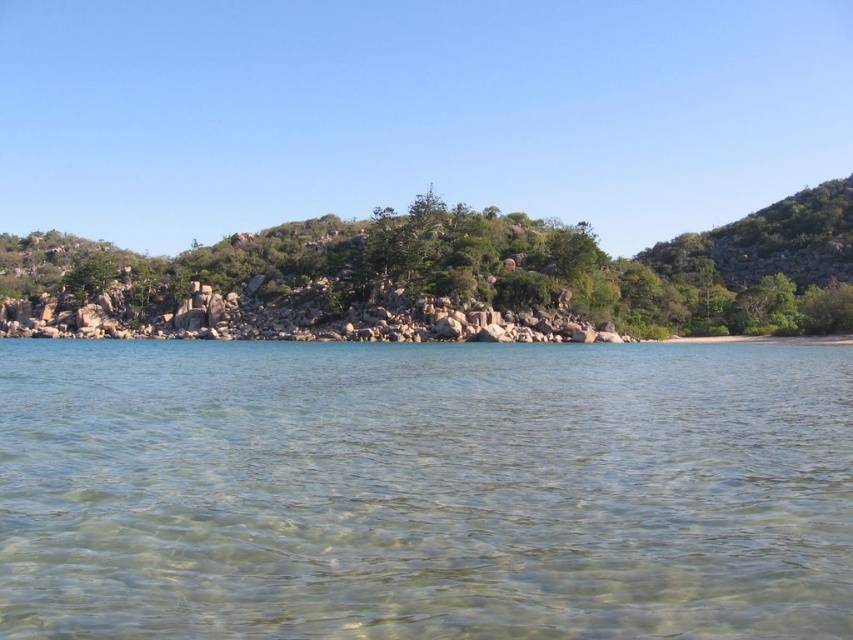
You are standing on the beach and want to walk from the clear water at center to the green textured rocks at center. Which direction should you move to reach the rocks?

To reach the green textured rocks at center from the clear water at center, you should move to the right since the clear water at center is located to the left of the rocks.